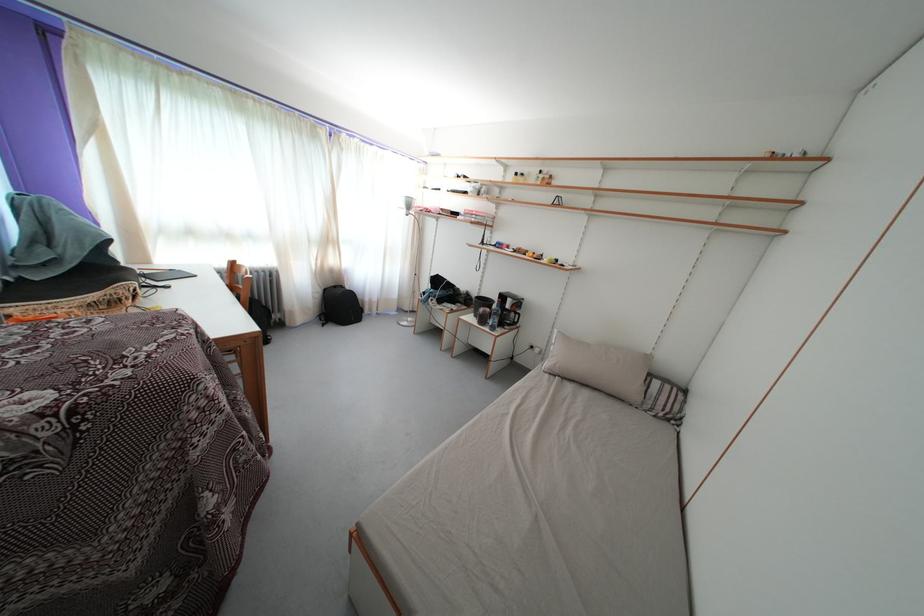
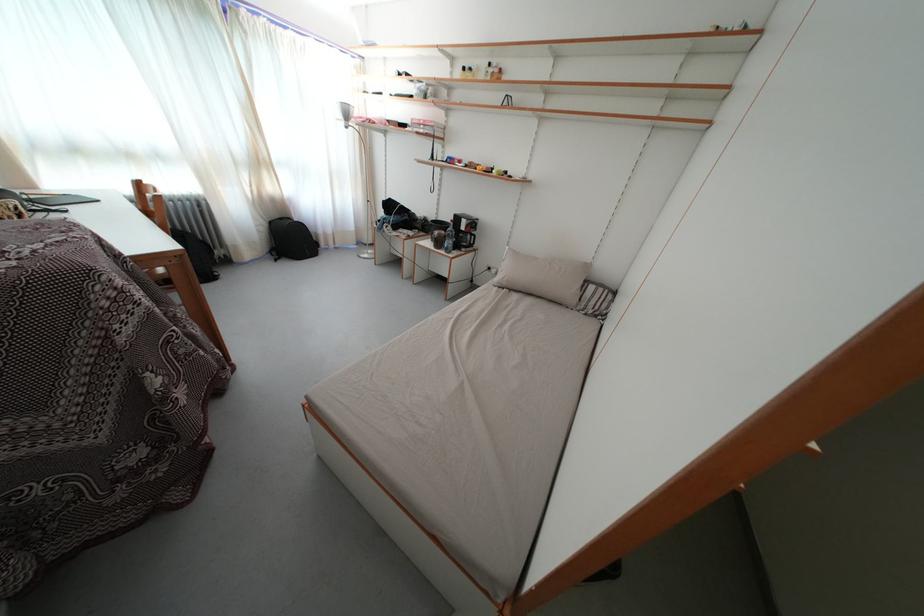
Find the pixel in the second image that matches point (542, 355) in the first image.

(500, 276)